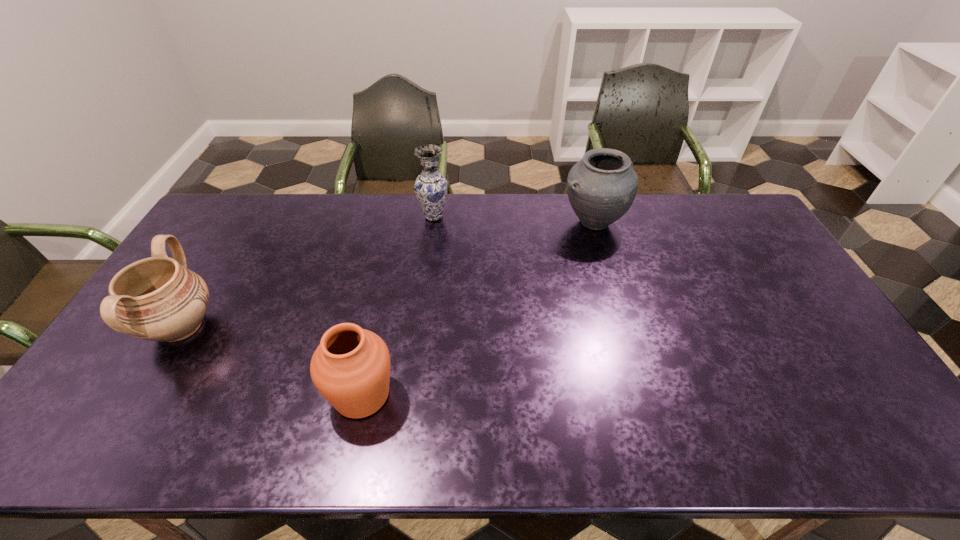
Choose which urn is the second nearest neighbor to the leftmost object. Please provide its 2D coordinates. Your answer should be formatted as a tuple, i.e. [(x, y)], where the tuple contains the x and y coordinates of a point satisfying the conditions above.

[(601, 187)]

Find the location of `vacant space that satisfies the following two spatial constraints: 1. on the front side of the rightmost object; 2. on the front-facing side of the leftmost urn`. vacant space that satisfies the following two spatial constraints: 1. on the front side of the rightmost object; 2. on the front-facing side of the leftmost urn is located at coordinates (623, 327).

This screenshot has height=540, width=960. I want to click on vacant space that satisfies the following two spatial constraints: 1. on the front-facing side of the second urn from left to right; 2. on the left side of the leftmost object, so point(139,395).

Identify the location of vacant space that satisfies the following two spatial constraints: 1. on the front-facing side of the leftmost urn; 2. on the left side of the second urn from left to right. The image size is (960, 540). (139, 395).

Locate an element on the screen. free space that satisfies the following two spatial constraints: 1. on the front side of the rightmost urn; 2. on the front-facing side of the leftmost object is located at coordinates (623, 327).

Find the location of `blank space that satisfies the following two spatial constraints: 1. on the front-facing side of the second urn from right to left; 2. on the left side of the leftmost object`. blank space that satisfies the following two spatial constraints: 1. on the front-facing side of the second urn from right to left; 2. on the left side of the leftmost object is located at coordinates (139, 395).

The height and width of the screenshot is (540, 960). I want to click on free space in the image that satisfies the following two spatial constraints: 1. on the back side of the second urn from right to left; 2. on the right side of the vase, so click(399, 217).